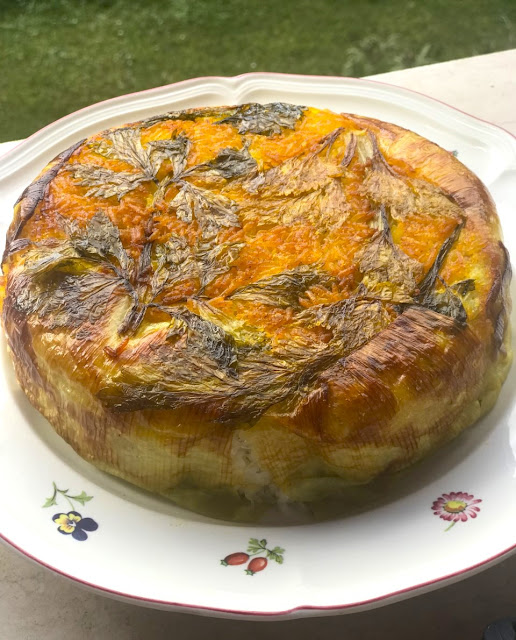
This screenshot has height=640, width=516. In order to click on edge of plate in this screenshot , I will do `click(207, 609)`.